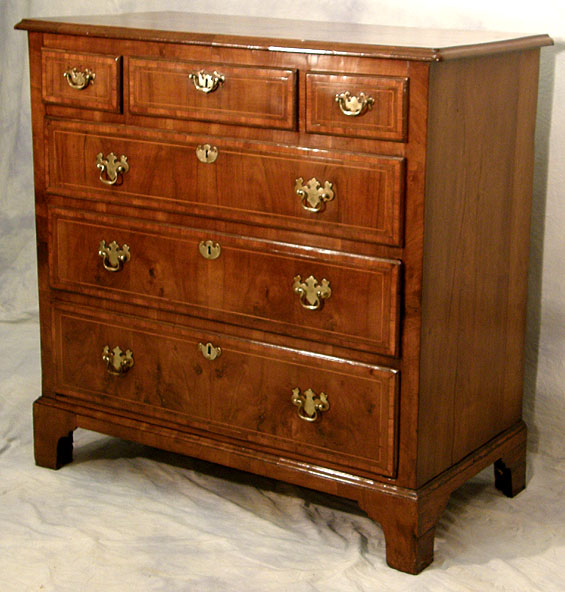
Locate an element on the screen. The height and width of the screenshot is (592, 565). top of drawer cabiner is located at coordinates (308, 38).